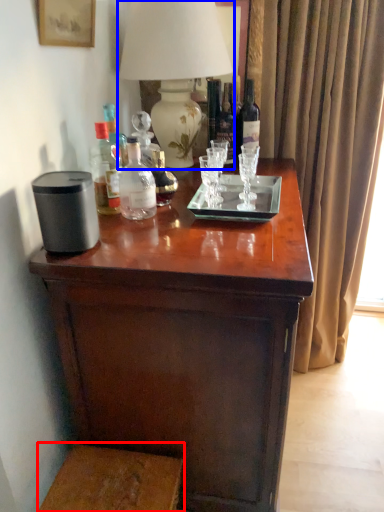
Question: Which object is closer to the camera taking this photo, step stool (highlighted by a red box) or table lamp (highlighted by a blue box)?

Choices:
 (A) step stool
 (B) table lamp

Answer: (A)